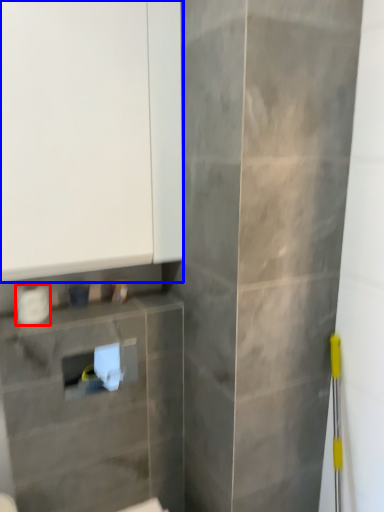
Question: Which object appears closest to the camera in this image, toilet paper (highlighted by a red box) or cabinetry (highlighted by a blue box)?

Choices:
 (A) toilet paper
 (B) cabinetry

Answer: (B)